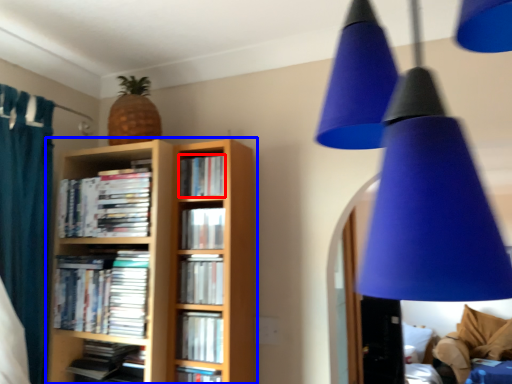
Question: Among these objects, which one is nearest to the camera, book (highlighted by a red box) or bookcase (highlighted by a blue box)?

Choices:
 (A) book
 (B) bookcase

Answer: (B)